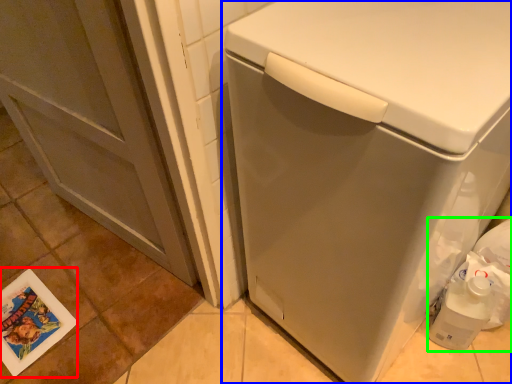
Question: Which object is the closest to the postcard (highlighted by a red box)? Choose among these: washing machine (highlighted by a blue box) or garbage (highlighted by a green box).

Choices:
 (A) washing machine
 (B) garbage

Answer: (A)